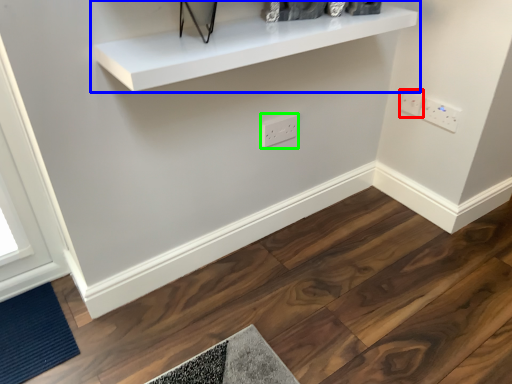
Question: Estimate the real-world distances between objects in this image. Which object is farther from electric outlet (highlighted by a red box), shelf (highlighted by a blue box) or electric outlet (highlighted by a green box)?

Choices:
 (A) shelf
 (B) electric outlet

Answer: (A)